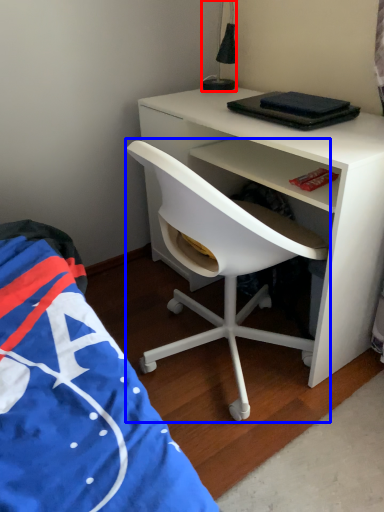
Question: Which point is closer to the camera, lamp (highlighted by a red box) or chair (highlighted by a blue box)?

Choices:
 (A) lamp
 (B) chair

Answer: (B)